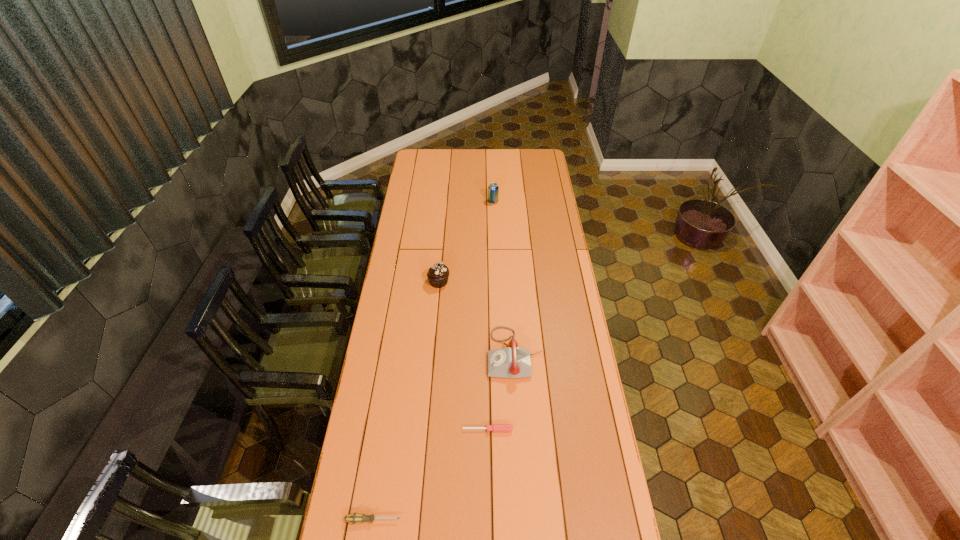
Where is `vacant space located 0.200m on the dial of the third nearest object`? This screenshot has width=960, height=540. vacant space located 0.200m on the dial of the third nearest object is located at coordinates (437, 353).

Where is `free location located on the dial of the third nearest object`? The width and height of the screenshot is (960, 540). free location located on the dial of the third nearest object is located at coordinates (412, 353).

Identify the location of vacant space situated on the dial of the third nearest object. (472, 353).

Locate an element on the screen. The image size is (960, 540). vacant region located at the tip of the nearer screwdriver is located at coordinates (503, 520).

Identify the location of vacant space located on the back of the right screwdriver. (487, 346).

The image size is (960, 540). Identify the location of object present at the left edge. (354, 518).

Where is `vacant space at the far edge of the desktop`? vacant space at the far edge of the desktop is located at coordinates (451, 154).

The image size is (960, 540). I want to click on free location at the left edge, so click(411, 190).

In the image, there is a desktop. Identify the location of vacant space at the right edge. The image size is (960, 540). (551, 193).

Where is `free space between the left screwdriver and the farthest object`? free space between the left screwdriver and the farthest object is located at coordinates (433, 361).